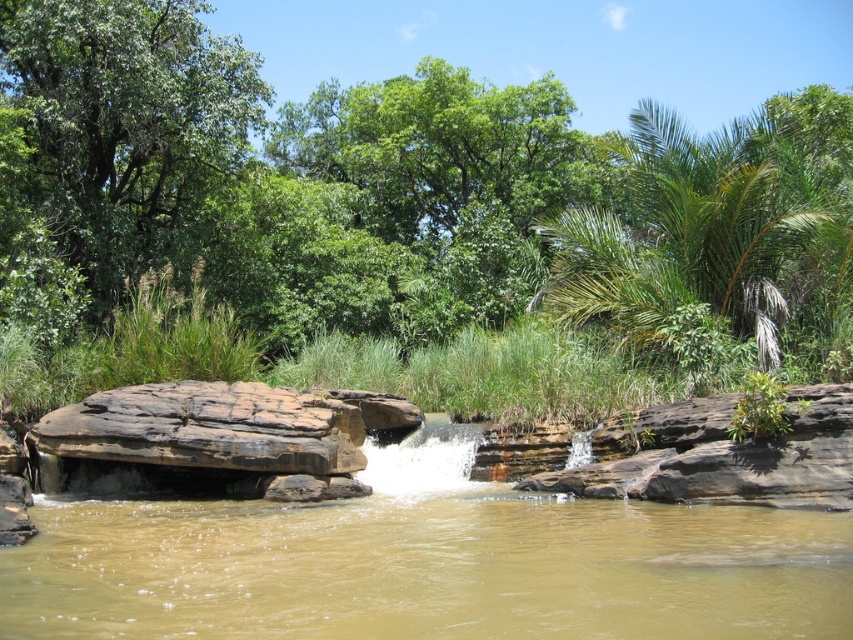
You are standing at the edge of the waterfall and want to place a small flag on the closest rock to you. Which rock should you choose between the brown sedimentary rock at center and the brown rough rock at center?

The brown sedimentary rock at center is closer to the viewer, so you should place the flag on the brown sedimentary rock at center.

You are a geologist examining the rocks in the waterfall scene. You have to determine which rock is taller between the brown sedimentary rock at center and the brown rough rock at center. Based on the scene, which one is taller?

The brown rough rock at center is taller than the brown sedimentary rock at center.

You are a hiker who wants to cross the river using the rocks. The brown sedimentary rock at center is your stepping stone. Can you step onto the green leafy palm at upper right from there?

The brown sedimentary rock at center is smaller than the green leafy palm at upper right, so it might not provide enough stable footing to reach the green leafy palm at upper right. It is safer to choose a larger rock for crossing.